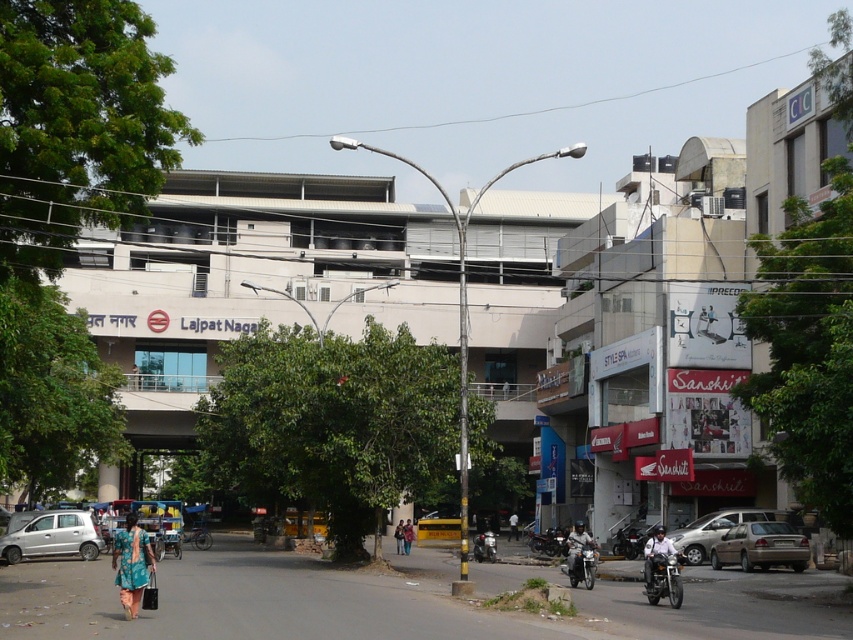
Question: Which object is positioned closest to the shiny chrome motorcycle at center?

Choices:
 (A) green fabric dress at center
 (B) dark blue shirt at center
 (C) metallic silver helmet at center

Answer: (C)

Question: Which point is farther to the camera?

Choices:
 (A) teal floral dress at lower left
 (B) silver metallic car at lower left
 (C) metallic silver helmet at center

Answer: (B)

Question: From the image, what is the correct spatial relationship of metallic silver motorcycle at lower right in relation to metallic silver helmet at center?

Choices:
 (A) above
 (B) below

Answer: (A)

Question: Where is shiny chrome motorcycle at center located in relation to metallic silver helmet at center in the image?

Choices:
 (A) right
 (B) left

Answer: (A)

Question: Does silver metallic sedan at lower right come behind green fabric dress at lower center?

Choices:
 (A) no
 (B) yes

Answer: (A)

Question: Which point is farther to the camera?

Choices:
 (A) (677, 536)
 (B) (476, 545)

Answer: (B)